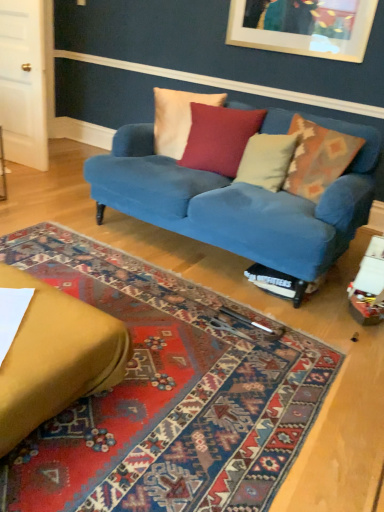
Question: Is carpeted rug at center spatially inside velvet blue couch at center, placed as the 1th studio couch when sorted from back to front, or outside of it?

Choices:
 (A) outside
 (B) inside

Answer: (A)

Question: Looking at the image, does carpeted rug at center seem bigger or smaller compared to velvet blue couch at center, arranged as the 2th studio couch when viewed from the front?

Choices:
 (A) big
 (B) small

Answer: (B)

Question: Which of these objects is positioned farthest from the white soft pillow at center, the second pillow from the right?

Choices:
 (A) velvet yellow studio couch at lower left, which is counted as the first studio couch, starting from the front
 (B) white cotton pillow at center, which is the fourth pillow from right to left
 (C) velvet blue couch at center, arranged as the 2th studio couch when viewed from the front
 (D) carpeted rug at center
 (E) velvet cushion at center, the third pillow when ordered from right to left

Answer: (A)

Question: Which is nearer to the velvet cushion at center, the second pillow from the left?

Choices:
 (A) velvet yellow studio couch at lower left, which ranks as the second studio couch in back-to-front order
 (B) white soft pillow at center, the second pillow from the right
 (C) carpeted rug at center
 (D) white cotton pillow at center, which is the fourth pillow from right to left
 (E) textured wool pillow at center, the 4th pillow positioned from the left

Answer: (D)